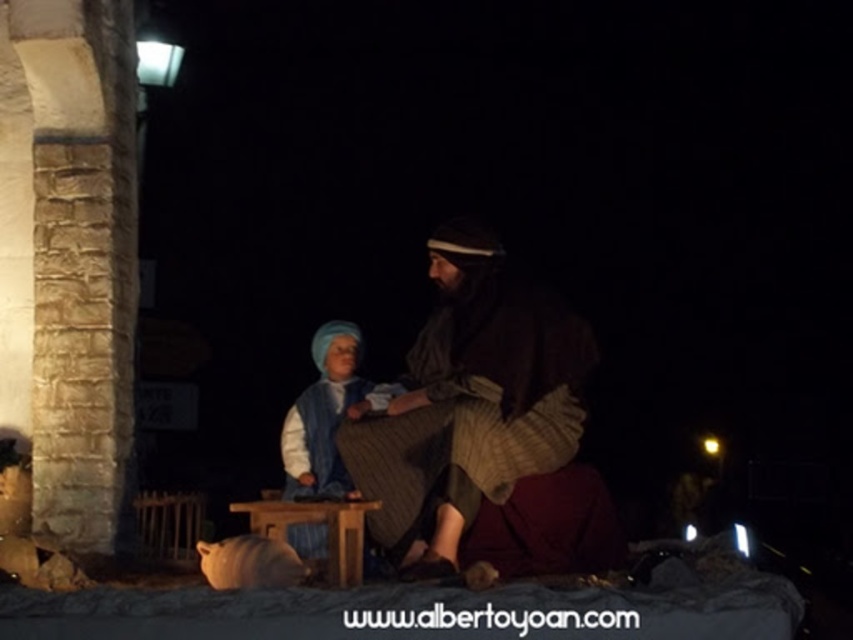
Looking at this image, who is lower down, brown stone pillar at left or wooden stool at center?

wooden stool at center is below.

Does brown stone pillar at left have a larger size compared to wooden stool at center?

Indeed, brown stone pillar at left has a larger size compared to wooden stool at center.

This screenshot has height=640, width=853. Identify the location of brown stone pillar at left. (68, 257).

Image resolution: width=853 pixels, height=640 pixels. Describe the element at coordinates (469, 401) in the screenshot. I see `brown textured fabric at center` at that location.

Is brown textured fabric at center below blue woolen scarf at center?

Indeed, brown textured fabric at center is positioned under blue woolen scarf at center.

Is point (387, 428) positioned in front of point (331, 496)?

No, it is behind (331, 496).

The image size is (853, 640). Find the location of `brown textured fabric at center`. brown textured fabric at center is located at coordinates (469, 401).

Who is higher up, brown stone pillar at left or blue woolen scarf at center?

brown stone pillar at left

Does brown stone pillar at left appear under blue woolen scarf at center?

Actually, brown stone pillar at left is above blue woolen scarf at center.

Who is more distant from viewer, (107, 108) or (310, 388)?

The point (310, 388) is behind.

Where is `brown stone pillar at left`? This screenshot has height=640, width=853. brown stone pillar at left is located at coordinates (68, 257).